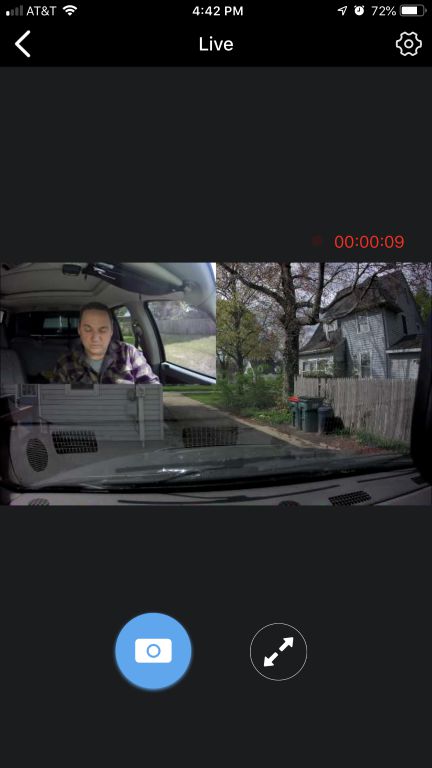
Identify the location of seat. This screenshot has height=768, width=432. (12, 369), (41, 358).